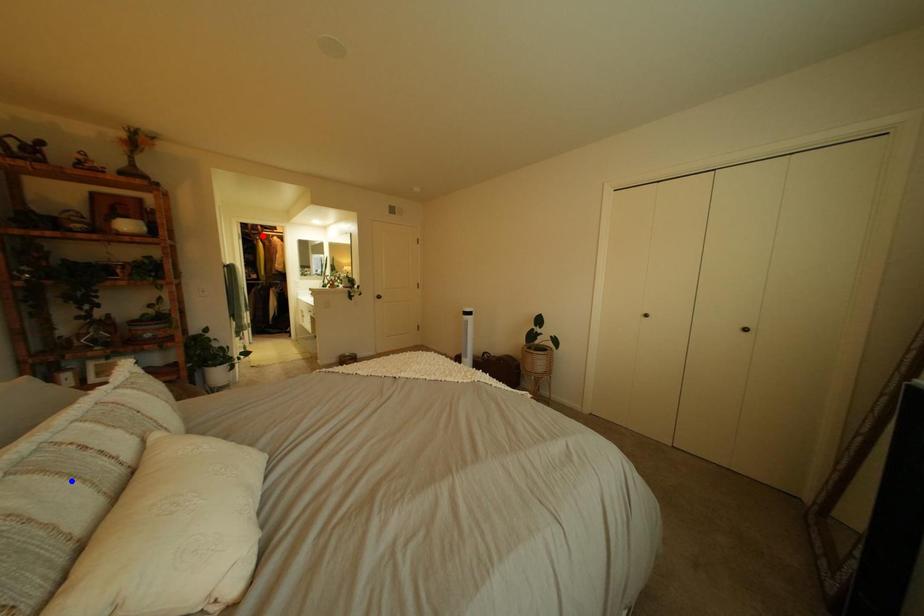
Question: In the image, two points are highlighted. Which point is nearer to the camera? Reply with the corresponding letter.

Choices:
 (A) blue point
 (B) red point

Answer: (A)